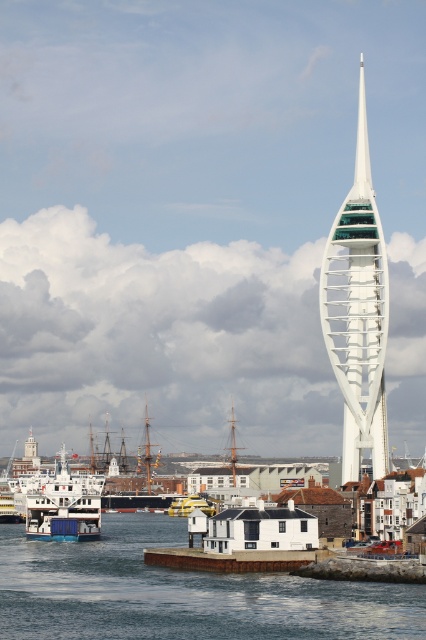
Question: Among these points, which one is farthest from the camera?

Choices:
 (A) (348, 326)
 (B) (0, 561)
 (C) (175, 513)

Answer: (C)

Question: Does transparent water at lower center appear on the right side of yellow rubber boat at center?

Choices:
 (A) yes
 (B) no

Answer: (B)

Question: Which is nearer to the white metallic tower at center?

Choices:
 (A) transparent water at lower center
 (B) yellow rubber boat at center
 (C) white glossy ferry at lower left

Answer: (B)

Question: Which point is closer to the camera?

Choices:
 (A) (57, 524)
 (B) (178, 500)

Answer: (A)

Question: Is transparent water at lower center closer to the viewer compared to white glossy ferry at lower left?

Choices:
 (A) no
 (B) yes

Answer: (B)

Question: Does transparent water at lower center have a lesser width compared to white metallic tower at center?

Choices:
 (A) no
 (B) yes

Answer: (A)